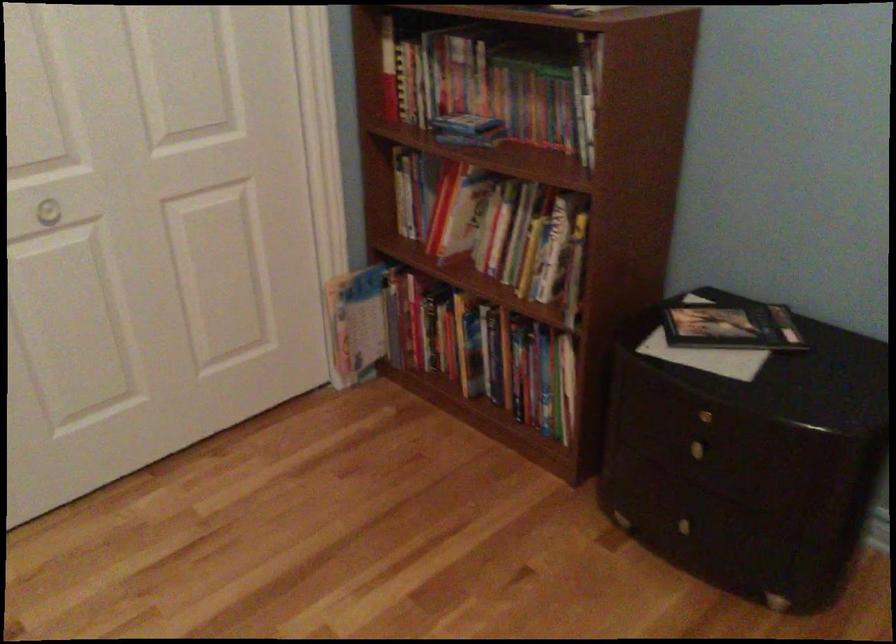
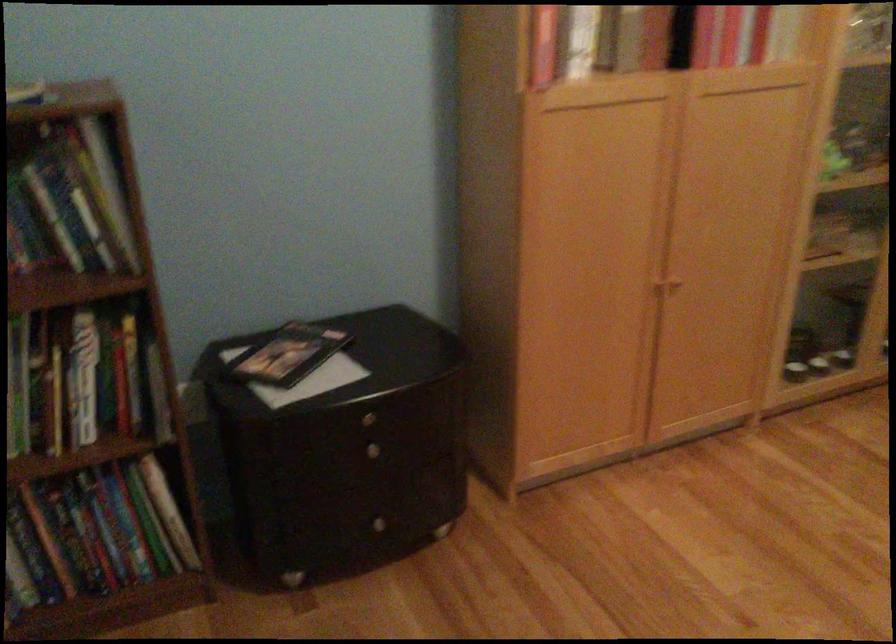
The point at (702,458) is marked in the first image. Where is the corresponding point in the second image?

(376, 457)